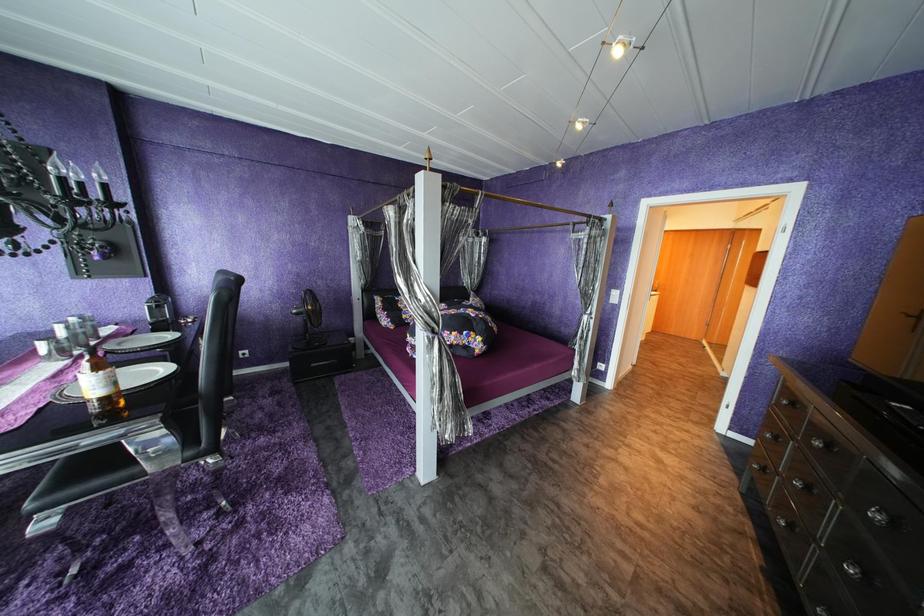
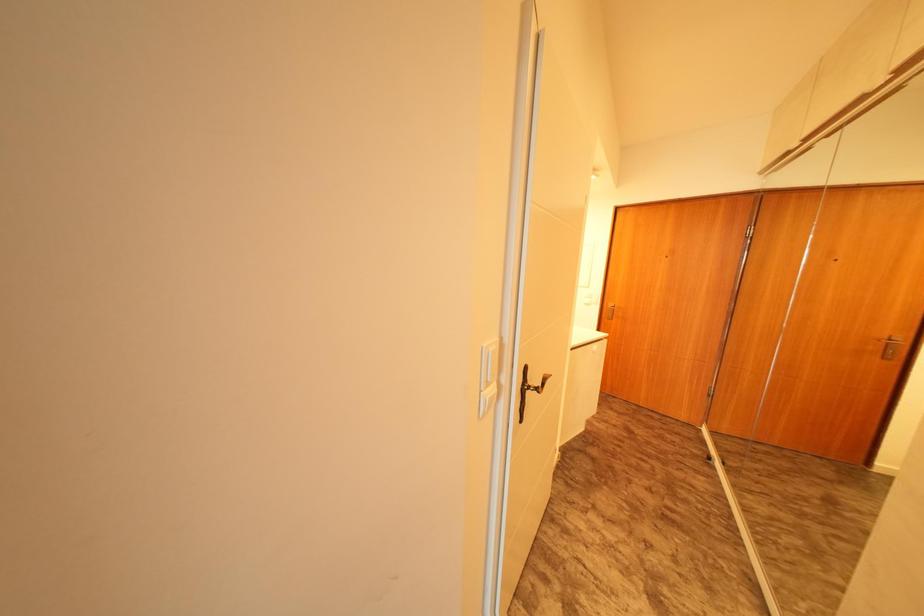
From the picture: The images are taken continuously from a first-person perspective. In which direction are you moving?

The cameraman walked toward right, forward.